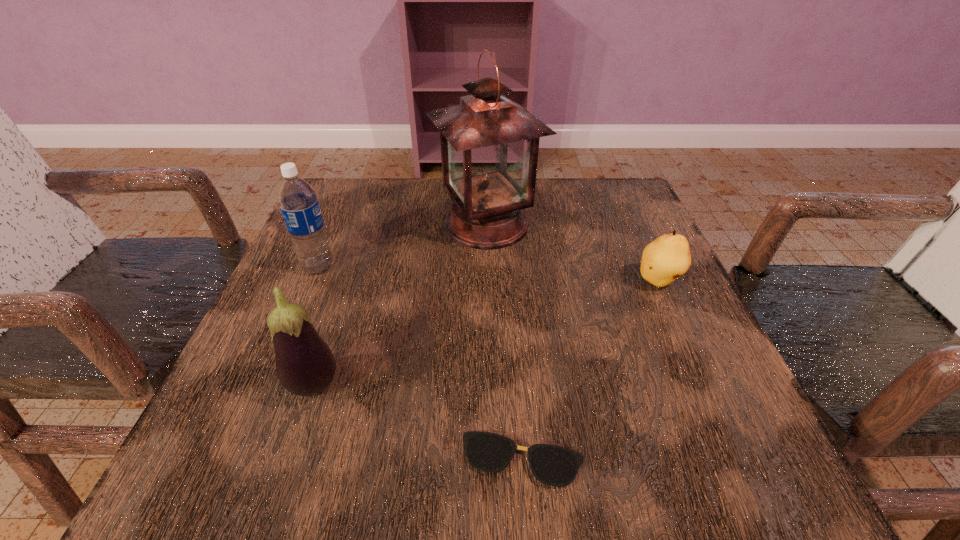
This screenshot has height=540, width=960. In order to click on vacant space situated on the front of the fourth farthest object in this screenshot , I will do `click(285, 474)`.

Where is `free point located on the left of the pear`? The width and height of the screenshot is (960, 540). free point located on the left of the pear is located at coordinates (493, 281).

This screenshot has height=540, width=960. I want to click on free spot located on the left of the spectacles, so click(316, 460).

At what (x,y) coordinates should I click in order to perform the action: click on object at the far edge. Please return your answer as a coordinate pair (x, y). Image resolution: width=960 pixels, height=540 pixels. Looking at the image, I should click on (489, 144).

The width and height of the screenshot is (960, 540). Find the location of `object located at the near edge`. object located at the near edge is located at coordinates [552, 465].

Identify the location of water bottle at the left edge. Image resolution: width=960 pixels, height=540 pixels. (298, 202).

Identify the location of eggplant at the left edge. The width and height of the screenshot is (960, 540). (305, 365).

At what (x,y) coordinates should I click in order to perform the action: click on object at the right edge. Please return your answer as a coordinate pair (x, y). The height and width of the screenshot is (540, 960). Looking at the image, I should click on (664, 260).

This screenshot has width=960, height=540. Find the location of `free point at the far edge`. free point at the far edge is located at coordinates (405, 190).

What are the coordinates of `vacant area at the near edge of the desktop` in the screenshot? It's located at (573, 448).